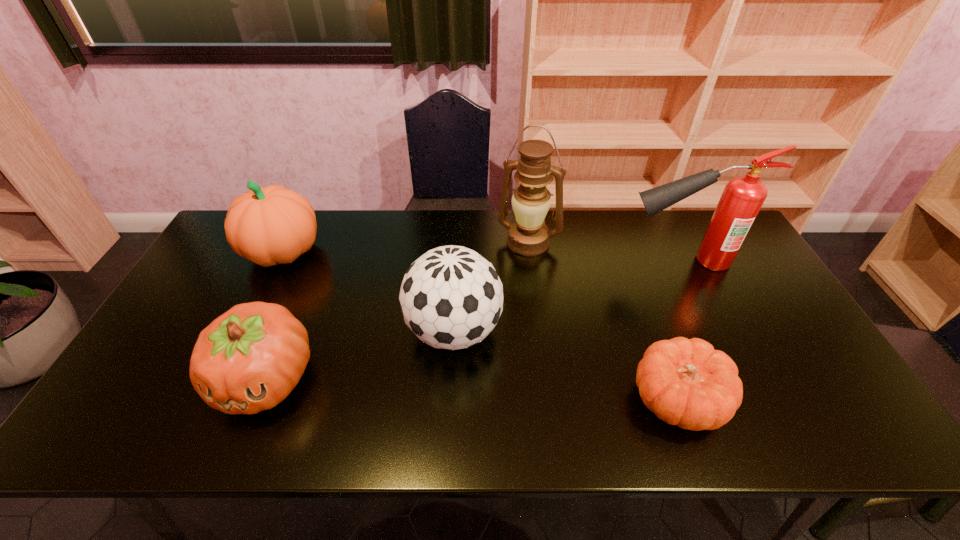
This screenshot has width=960, height=540. Identify the location of oil lamp. (529, 236).

I want to click on fire extinguisher, so pos(743,196).

The height and width of the screenshot is (540, 960). I want to click on the farthest pumpkin, so pos(272,225).

The image size is (960, 540). What are the coordinates of `the third object from left to right` in the screenshot? It's located at (451, 297).

Find the location of `the second shortest pumpkin`. the second shortest pumpkin is located at coordinates point(249,359).

You are a GUI agent. You are given a task and a screenshot of the screen. Output one action in this format:
    pyautogui.click(x=<x>, y=<y>)
    Task: Click on the shortest object
    The image size is (960, 540).
    Given the screenshot: What is the action you would take?
    pyautogui.click(x=685, y=382)

You are a GUI agent. You are given a task and a screenshot of the screen. Output one action in this format:
    pyautogui.click(x=<x>, y=<y>)
    Task: Click on the shortest pumpkin
    This screenshot has width=960, height=540.
    Given the screenshot: What is the action you would take?
    pyautogui.click(x=685, y=382)

Locate an element on the screen. vacant space located on the front of the fourth object from left to right is located at coordinates (540, 329).

Where is `vacant region located at the nozzle of the fire extinguisher`? vacant region located at the nozzle of the fire extinguisher is located at coordinates (530, 261).

This screenshot has height=540, width=960. I want to click on vacant area situated 0.130m at the nozzle of the fire extinguisher, so click(x=580, y=261).